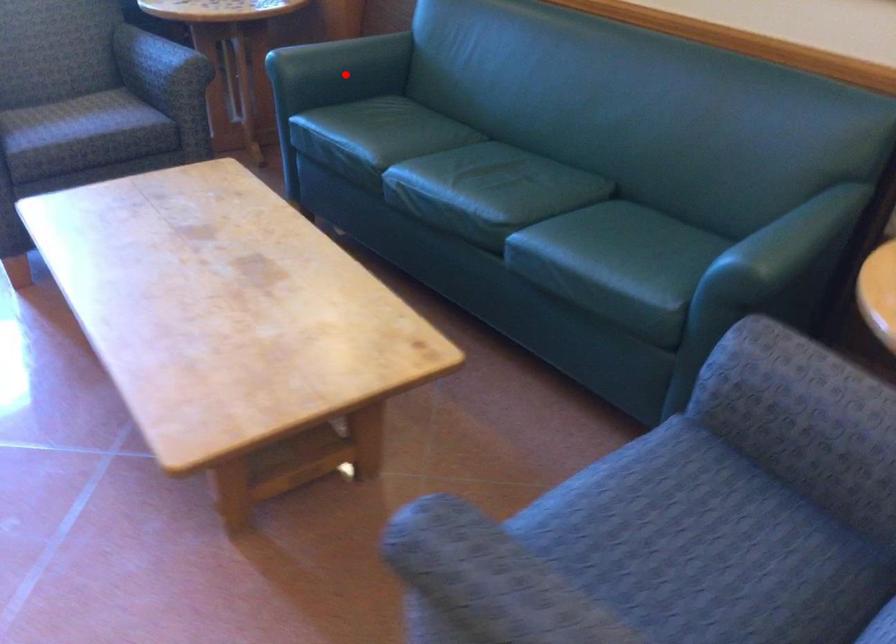
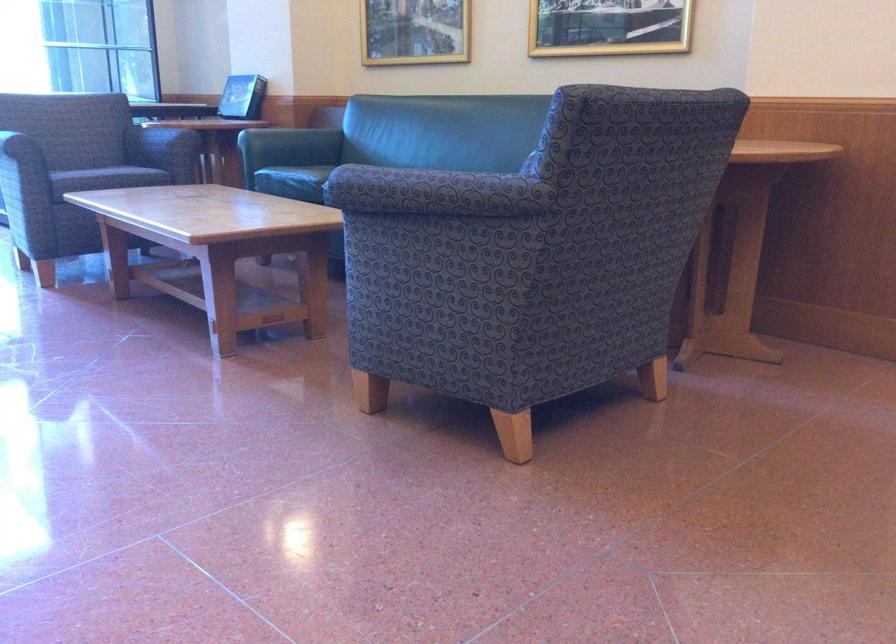
The point at the highlighted location is marked in the first image. Where is the corresponding point in the second image?

(290, 145)